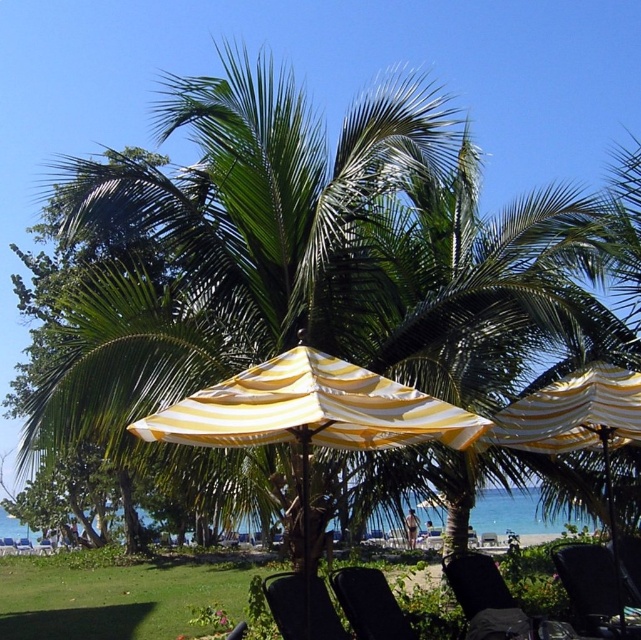
Is yellow striped umbrella at center further to camera compared to black fabric beach chair at lower right?

No.

Who is lower down, yellow striped umbrella at center or black fabric beach chair at lower right?

black fabric beach chair at lower right

The image size is (641, 640). What are the coordinates of `yellow striped umbrella at center` in the screenshot? It's located at [x=576, y=420].

Is yellow striped fabric umbrella at center to the left of yellow striped umbrella at center from the viewer's perspective?

Indeed, yellow striped fabric umbrella at center is positioned on the left side of yellow striped umbrella at center.

Who is shorter, yellow striped fabric umbrella at center or yellow striped umbrella at center?

yellow striped fabric umbrella at center

Does point (387, 438) come farther from viewer compared to point (537, 396)?

No, it is not.

This screenshot has height=640, width=641. I want to click on yellow striped fabric umbrella at center, so click(310, 412).

Does yellow striped fabric umbrella at center have a greater width compared to black fabric chair at lower right?

Yes.

Does yellow striped fabric umbrella at center appear over black fabric chair at lower right?

Yes.

Does point (437, 435) come closer to viewer compared to point (620, 598)?

Yes, point (437, 435) is in front of point (620, 598).

In order to click on yellow striped fabric umbrella at center in this screenshot , I will do `click(310, 412)`.